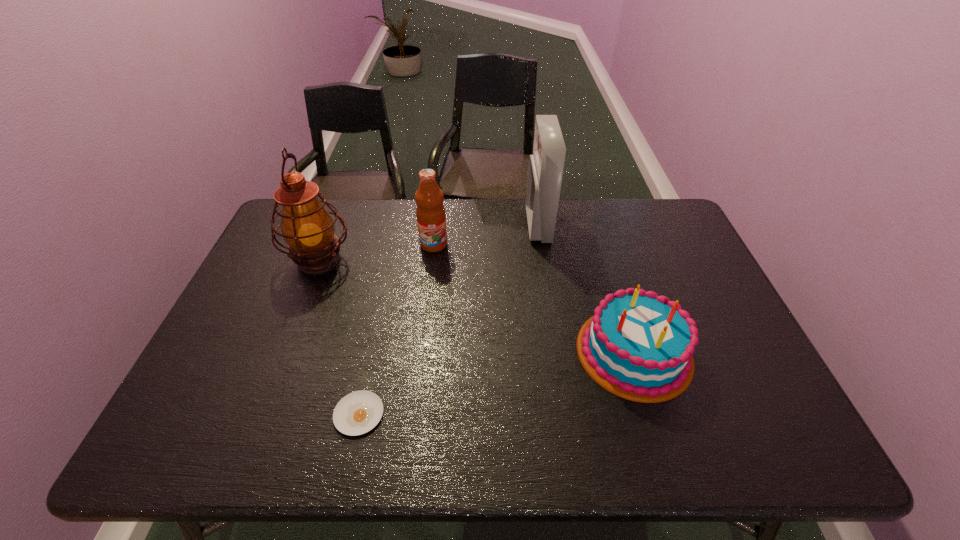
Find the location of `vacant area that lies between the third shortest object and the egg yolk`. vacant area that lies between the third shortest object and the egg yolk is located at coordinates (396, 329).

At what (x,y) coordinates should I click in order to perform the action: click on unoccupied position between the second object from left to right and the leftmost object. Please return your answer as a coordinate pair (x, y). This screenshot has width=960, height=540. Looking at the image, I should click on (339, 337).

Locate an element on the screen. The image size is (960, 540). empty space between the oil lamp and the rightmost object is located at coordinates (476, 306).

At what (x,y) coordinates should I click in order to perform the action: click on vacant area that lies between the leftmost object and the shortest object. Please return your answer as a coordinate pair (x, y). The height and width of the screenshot is (540, 960). Looking at the image, I should click on (339, 337).

Find the location of a particular element. The image size is (960, 540). free space between the second shortest object and the oil lamp is located at coordinates (476, 306).

Where is `vacant area between the egg yolk and the third tallest object`? The height and width of the screenshot is (540, 960). vacant area between the egg yolk and the third tallest object is located at coordinates (396, 329).

I want to click on object that can be found as the third closest to the shortest object, so click(431, 218).

Select which object appears as the closest to the oil lamp. Please provide its 2D coordinates. Your answer should be formatted as a tuple, i.e. [(x, y)], where the tuple contains the x and y coordinates of a point satisfying the conditions above.

[(431, 218)]

Locate an element on the screen. The image size is (960, 540). free spot that satisfies the following two spatial constraints: 1. on the front label of the third shortest object; 2. on the left side of the rightmost object is located at coordinates (421, 352).

The image size is (960, 540). Identify the location of vacant area that satisfies the following two spatial constraints: 1. on the front-facing side of the second object from right to left; 2. on the front label of the fruit juice. [541, 244].